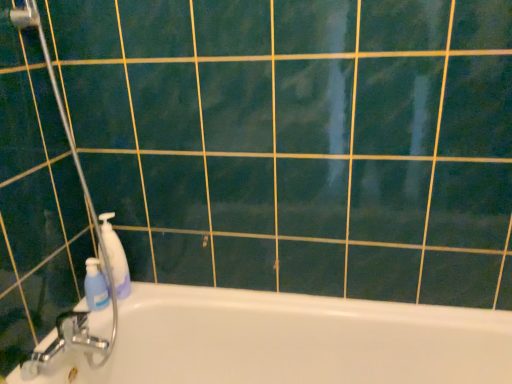
Question: From a real-world perspective, is blue plastic bottle at left, marked as the 1th cleaning product in a left-to-right arrangement, physically above white glossy bathtub at lower left?

Choices:
 (A) yes
 (B) no

Answer: (A)

Question: Does blue plastic bottle at left, marked as the 1th cleaning product in a left-to-right arrangement, have a smaller size compared to white glossy bathtub at lower left?

Choices:
 (A) no
 (B) yes

Answer: (B)

Question: From a real-world perspective, is blue plastic bottle at left, marked as the 1th cleaning product in a left-to-right arrangement, located beneath white glossy bathtub at lower left?

Choices:
 (A) yes
 (B) no

Answer: (B)

Question: Can you confirm if blue plastic bottle at left, arranged as the 2th cleaning product when viewed from the right, is shorter than white glossy bathtub at lower left?

Choices:
 (A) no
 (B) yes

Answer: (B)

Question: Is blue plastic bottle at left, arranged as the 2th cleaning product when viewed from the right, not within white glossy bathtub at lower left?

Choices:
 (A) no
 (B) yes

Answer: (A)

Question: Is white glossy bathtub at lower left inside blue plastic bottle at left, arranged as the 2th cleaning product when viewed from the right?

Choices:
 (A) no
 (B) yes

Answer: (A)

Question: From the image's perspective, is white glossy bathtub at lower left on top of blue plastic bottle at left, arranged as the 2th cleaning product when viewed from the right?

Choices:
 (A) yes
 (B) no

Answer: (B)

Question: From a real-world perspective, is white glossy bathtub at lower left positioned over blue plastic bottle at left, arranged as the 2th cleaning product when viewed from the right, based on gravity?

Choices:
 (A) no
 (B) yes

Answer: (A)

Question: Considering the relative positions of white glossy bathtub at lower left and blue plastic bottle at left, arranged as the 2th cleaning product when viewed from the right, in the image provided, is white glossy bathtub at lower left in front of blue plastic bottle at left, arranged as the 2th cleaning product when viewed from the right,?

Choices:
 (A) no
 (B) yes

Answer: (B)

Question: Considering the relative sizes of white glossy bathtub at lower left and blue plastic bottle at left, arranged as the 2th cleaning product when viewed from the right, in the image provided, is white glossy bathtub at lower left smaller than blue plastic bottle at left, arranged as the 2th cleaning product when viewed from the right,?

Choices:
 (A) no
 (B) yes

Answer: (A)

Question: Can you confirm if white glossy bathtub at lower left is wider than blue plastic bottle at left, arranged as the 2th cleaning product when viewed from the right?

Choices:
 (A) yes
 (B) no

Answer: (A)

Question: Does white glossy bathtub at lower left have a lesser width compared to blue plastic bottle at left, arranged as the 2th cleaning product when viewed from the right?

Choices:
 (A) no
 (B) yes

Answer: (A)

Question: Considering the relative sizes of white glossy bathtub at lower left and transparent plastic shower door at left in the image provided, is white glossy bathtub at lower left taller than transparent plastic shower door at left?

Choices:
 (A) yes
 (B) no

Answer: (B)